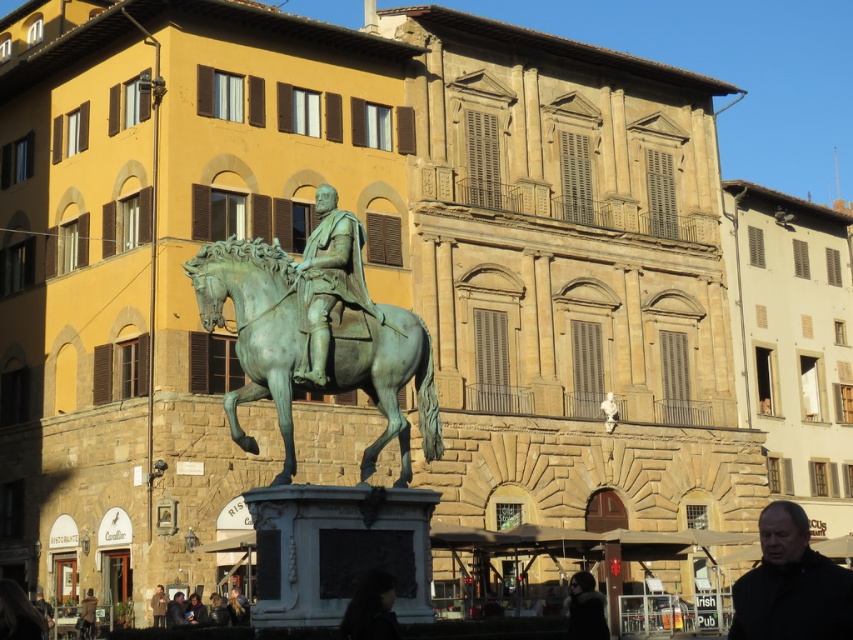
Question: Which of the following is the closest to the observer?

Choices:
 (A) (306, 320)
 (B) (344, 372)

Answer: (A)

Question: Estimate the real-world distances between objects in this image. Which object is farther from the brown leather jacket at lower center?

Choices:
 (A) black matte jacket at lower right
 (B) bronze statue at center
 (C) dark brown leather jacket at lower center

Answer: (A)

Question: Is green patina horse at center bigger than dark brown leather jacket at lower center?

Choices:
 (A) yes
 (B) no

Answer: (A)

Question: Can you confirm if black matte jacket at lower right is wider than brown leather jacket at lower center?

Choices:
 (A) no
 (B) yes

Answer: (B)

Question: Which point appears farthest from the camera in this image?

Choices:
 (A) (604, 636)
 (B) (399, 419)
 (C) (358, 298)

Answer: (B)

Question: Can you confirm if green patina horse at center is positioned to the left of bronze statue at center?

Choices:
 (A) yes
 (B) no

Answer: (A)